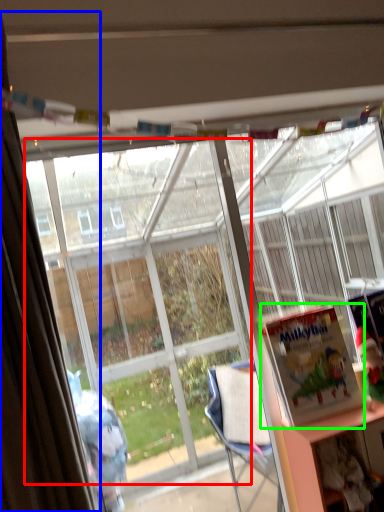
Question: Estimate the real-world distances between objects in this image. Which object is closer to bay window (highlighted by a red box), curtain (highlighted by a blue box) or book (highlighted by a green box)?

Choices:
 (A) curtain
 (B) book

Answer: (B)